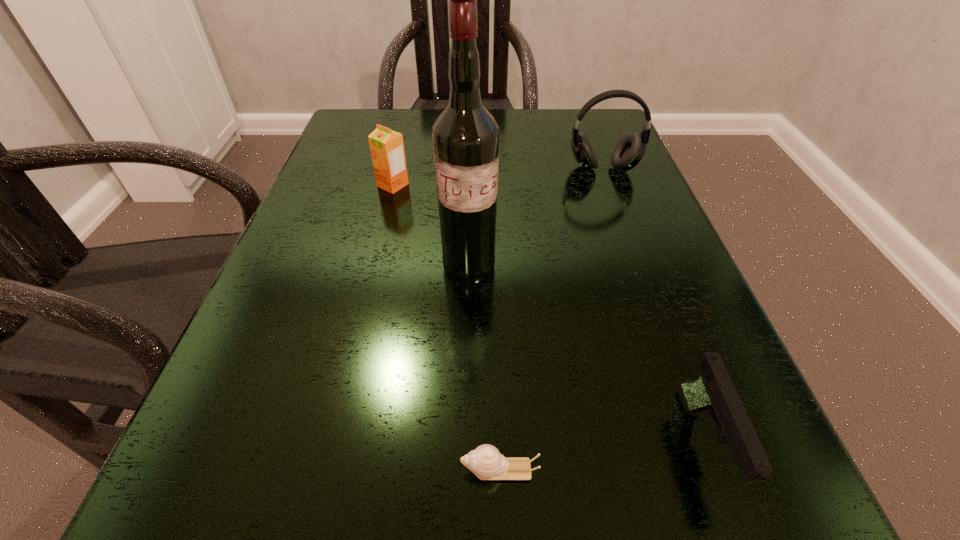
In order to click on unoccupied area between the fourth tallest object and the fourth shortest object in this screenshot , I will do `click(653, 306)`.

This screenshot has height=540, width=960. What are the coordinates of `free spot between the leftmost object and the headset` in the screenshot? It's located at (498, 177).

Where is `vacant space that's between the orange juice and the shortest object`? vacant space that's between the orange juice and the shortest object is located at coordinates (446, 327).

This screenshot has width=960, height=540. Find the location of `vacant area that lies between the third shortest object and the escargot`. vacant area that lies between the third shortest object and the escargot is located at coordinates (446, 327).

At what (x,y) coordinates should I click in order to perform the action: click on empty location between the pistol and the wine bottle. Please return your answer as a coordinate pair (x, y). Looking at the image, I should click on (586, 355).

Image resolution: width=960 pixels, height=540 pixels. Identify the location of vacant region between the shortest object and the fourth tallest object. (601, 456).

What are the coordinates of `vacant region between the shortest object and the second shortest object` in the screenshot? It's located at (601, 456).

The width and height of the screenshot is (960, 540). Find the location of `object that stands as the second closest to the shortest object`. object that stands as the second closest to the shortest object is located at coordinates (465, 136).

This screenshot has width=960, height=540. I want to click on object identified as the fourth closest to the pistol, so click(x=387, y=149).